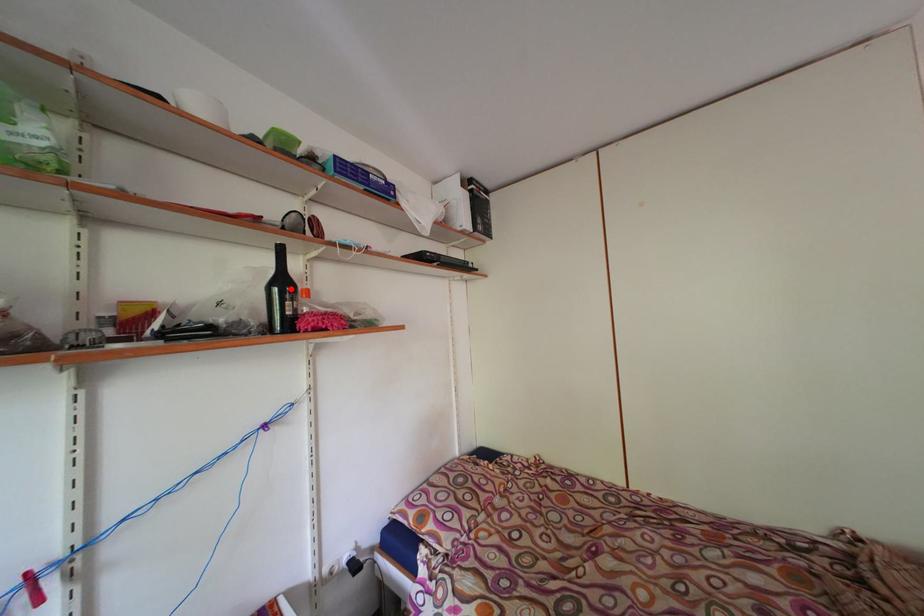
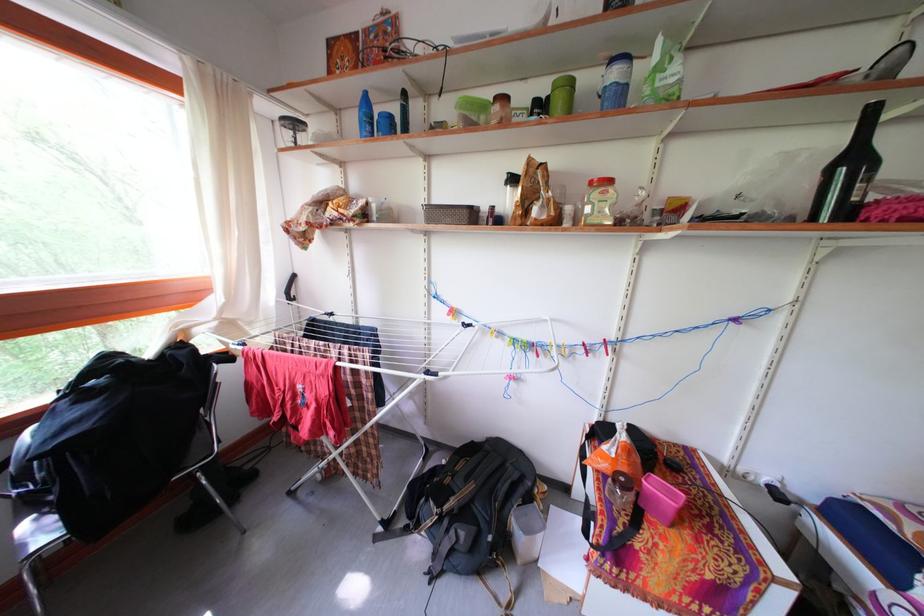
Find the pixel in the second image that matches the highlighted location in the first image.

(861, 166)